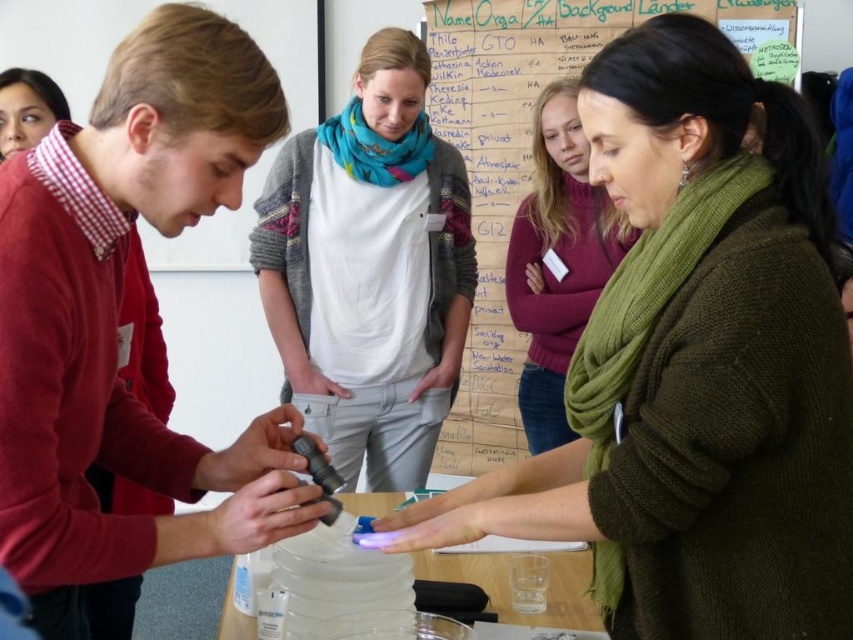
You are standing in the classroom and see the green knitted scarf at center and the clear plastic table at center. Which object is higher in position?

The green knitted scarf at center is above the clear plastic table at center, so it is higher in position.

You are standing at the entrance of the room and see the white cotton shirt at center and the clear plastic table at center. Which object is closer to the entrance?

The white cotton shirt at center is closer to the entrance because it is positioned to the left of the clear plastic table at center, implying it is nearer to the entrance.

You are an observer in the scene. You notice the green knitted scarf at center and the clear plastic table at center. Which object takes up more space in the image?

The green knitted scarf at center is larger in size than the clear plastic table at center, so it takes up more space in the image.